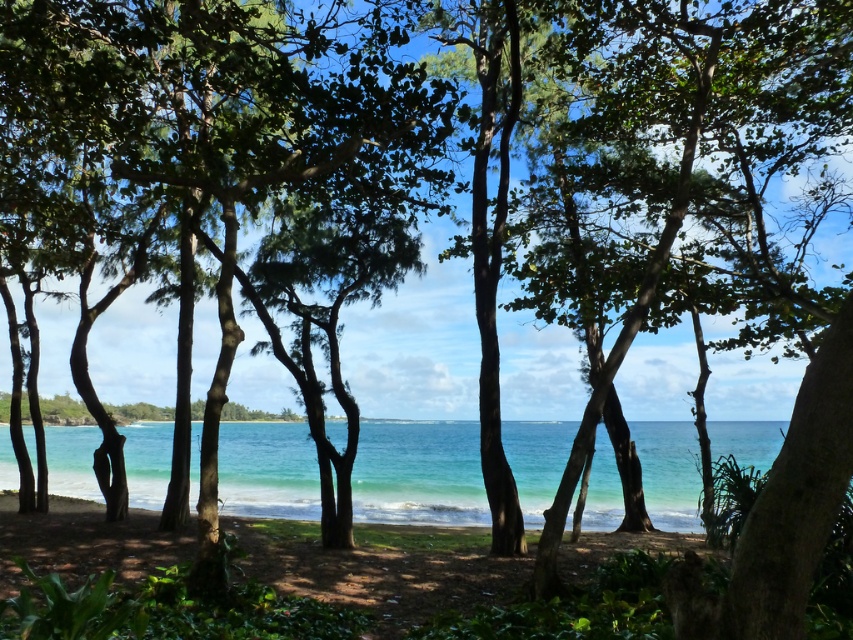
Which of these two, clear blue water at center or green sand at center, stands taller?

clear blue water at center

Who is more distant from viewer, (241, 502) or (76, 556)?

Point (241, 502)

Who is more forward, (x=71, y=442) or (x=277, y=536)?

Point (x=277, y=536)

Find the location of a particular element. The height and width of the screenshot is (640, 853). clear blue water at center is located at coordinates (418, 474).